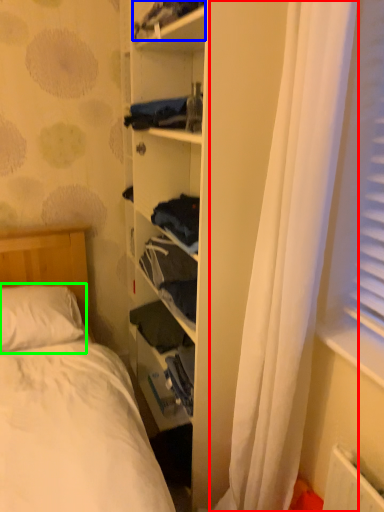
Question: Which object is the farthest from curtain (highlighted by a red box)? Choose among these: clothing (highlighted by a blue box) or pillow (highlighted by a green box).

Choices:
 (A) clothing
 (B) pillow

Answer: (B)